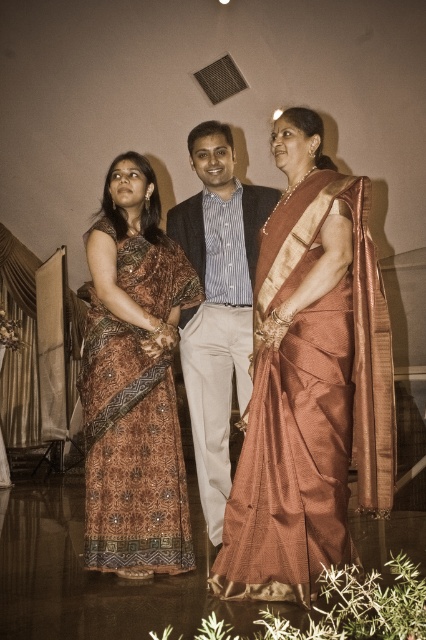
Can you confirm if brown printed saree at left is thinner than silk shirt at center?

Incorrect, brown printed saree at left's width is not less than silk shirt at center's.

Which of these two, brown printed saree at left or silk shirt at center, stands taller?

silk shirt at center is taller.

Image resolution: width=426 pixels, height=640 pixels. In order to click on brown printed saree at left in this screenshot , I will do `click(131, 451)`.

Image resolution: width=426 pixels, height=640 pixels. Identify the location of brown printed saree at left. click(x=131, y=451).

Which is behind, point (270, 429) or point (192, 346)?

The point (192, 346) is behind.

Based on the photo, can you confirm if shiny gold saree at center is shorter than silk shirt at center?

Indeed, shiny gold saree at center has a lesser height compared to silk shirt at center.

Does point (328, 387) lie in front of point (249, 204)?

Yes, point (328, 387) is closer to viewer.

Find the location of a particular element. Image resolution: width=426 pixels, height=640 pixels. shiny gold saree at center is located at coordinates (310, 381).

Does point (334, 488) lie in front of point (150, 257)?

Yes, point (334, 488) is closer to viewer.

Is point (302, 230) more distant than point (180, 525)?

No.

Where is `shiny gold saree at center`? shiny gold saree at center is located at coordinates (310, 381).